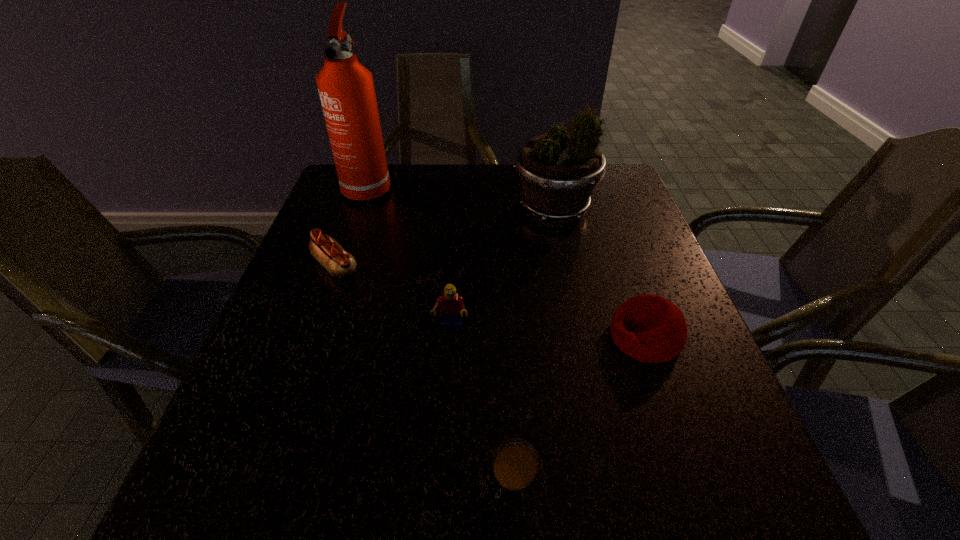
Locate an element on the screen. The height and width of the screenshot is (540, 960). free space located on the seat area of the third shortest object is located at coordinates (431, 336).

Find the location of a particular element. This screenshot has width=960, height=540. free region located on the seat area of the third shortest object is located at coordinates (585, 336).

You are a GUI agent. You are given a task and a screenshot of the screen. Output one action in this format:
    pyautogui.click(x=<x>, y=<y>)
    Task: Click on the vacant space located on the seat area of the third shortest object
    
    Given the screenshot: What is the action you would take?
    (x=425, y=336)

Locate an element on the screen. This screenshot has width=960, height=540. free space located 0.100m on the front of the fourth nearest object is located at coordinates (316, 320).

Identify the location of vacant area situated 0.380m on the back of the nearest object. [x=503, y=280].

The width and height of the screenshot is (960, 540). I want to click on fire extinguisher located at the far edge, so coord(346,89).

Locate an element on the screen. flowerpot that is at the far edge is located at coordinates (558, 172).

Locate an element on the screen. Image resolution: width=960 pixels, height=540 pixels. object located in the near edge section of the desktop is located at coordinates (514, 479).

The height and width of the screenshot is (540, 960). I want to click on fire extinguisher situated at the left edge, so click(346, 89).

Find the location of `sausage that is positioned at the left edge`. sausage that is positioned at the left edge is located at coordinates (339, 263).